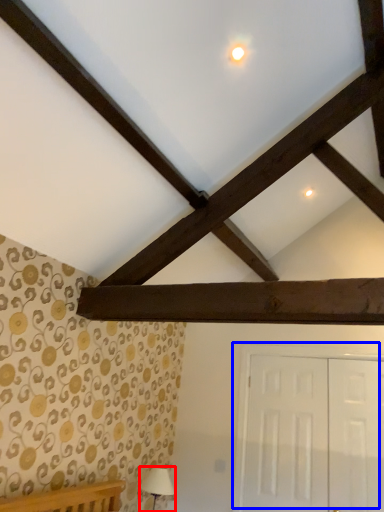
Question: Which point is closer to the camera, table lamp (highlighted by a red box) or door (highlighted by a blue box)?

Choices:
 (A) table lamp
 (B) door

Answer: (B)